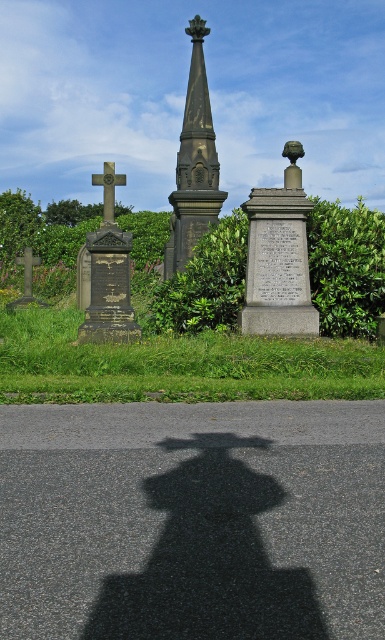
Does gray stone monument at center have a larger size compared to dark gray stone spire at center?

Actually, gray stone monument at center might be smaller than dark gray stone spire at center.

Does gray stone monument at center appear under dark gray stone spire at center?

Yes.

Is point (296, 250) less distant than point (202, 61)?

That is True.

The height and width of the screenshot is (640, 385). Identify the location of gray stone monument at center. (279, 257).

Can you confirm if green leafy hedge at center is positioned above dark gray stone spire at center?

Yes, green leafy hedge at center is above dark gray stone spire at center.

Is point (145, 240) closer to camera compared to point (194, 108)?

That is False.

In order to click on green leafy hedge at center in this screenshot , I will do `click(346, 266)`.

Can you confirm if green leafy hedge at center is taller than dark gray stone cross at left?

Yes, green leafy hedge at center is taller than dark gray stone cross at left.

This screenshot has width=385, height=640. Describe the element at coordinates (346, 266) in the screenshot. I see `green leafy hedge at center` at that location.

At what (x,y) coordinates should I click in order to perform the action: click on green leafy hedge at center. Please return your answer as a coordinate pair (x, y). The height and width of the screenshot is (640, 385). Looking at the image, I should click on (346, 266).